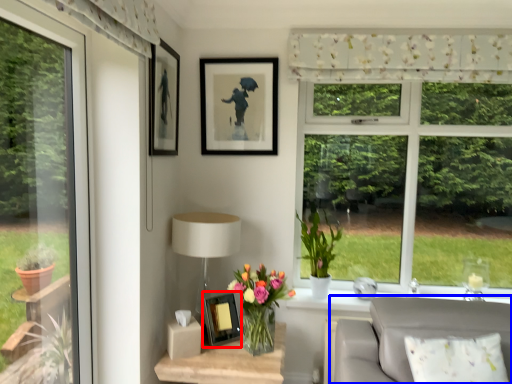
Question: Which of the following is the closest to the observer, picture frame (highlighted by a red box) or studio couch (highlighted by a blue box)?

Choices:
 (A) picture frame
 (B) studio couch

Answer: (B)